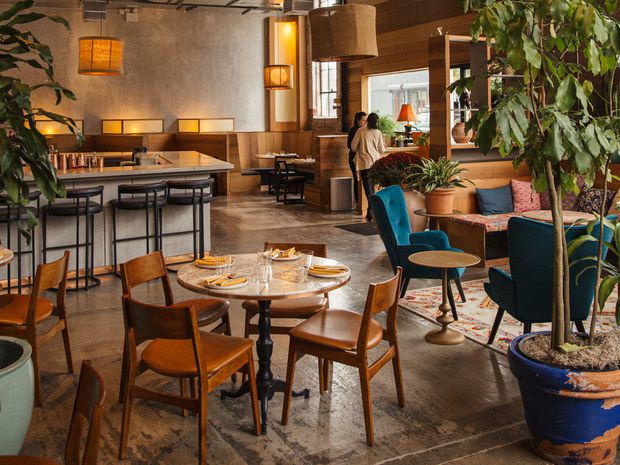
I want to click on napkins, so click(232, 280), click(327, 270), click(285, 249), click(206, 258).